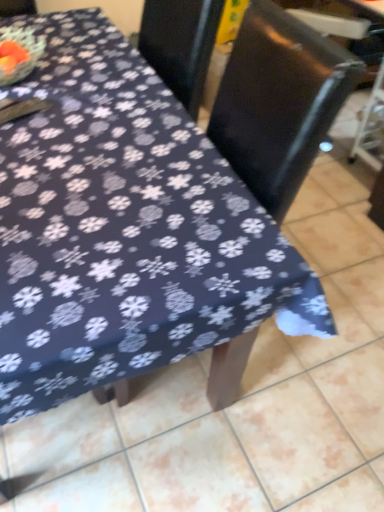
Question: Considering the relative sizes of black plastic swivel chair at right and black glossy chair at upper center in the image provided, is black plastic swivel chair at right thinner than black glossy chair at upper center?

Choices:
 (A) yes
 (B) no

Answer: (B)

Question: Does black plastic swivel chair at right have a greater width compared to black glossy chair at upper center?

Choices:
 (A) no
 (B) yes

Answer: (B)

Question: From the image's perspective, is black plastic swivel chair at right on top of black glossy chair at upper center?

Choices:
 (A) no
 (B) yes

Answer: (B)

Question: Is black plastic swivel chair at right shorter than black glossy chair at upper center?

Choices:
 (A) no
 (B) yes

Answer: (B)

Question: Is black plastic swivel chair at right not inside black glossy chair at upper center?

Choices:
 (A) no
 (B) yes

Answer: (B)

Question: From a real-world perspective, does black plastic swivel chair at right sit lower than black glossy chair at upper center?

Choices:
 (A) no
 (B) yes

Answer: (B)

Question: Can we say black glossy chair at upper center lies outside black plastic swivel chair at right?

Choices:
 (A) no
 (B) yes

Answer: (B)

Question: Is black glossy chair at upper center facing towards black plastic swivel chair at right?

Choices:
 (A) no
 (B) yes

Answer: (A)

Question: Is black glossy chair at upper center further to camera compared to black plastic swivel chair at right?

Choices:
 (A) yes
 (B) no

Answer: (B)

Question: Considering the relative sizes of black glossy chair at upper center and black plastic swivel chair at right in the image provided, is black glossy chair at upper center bigger than black plastic swivel chair at right?

Choices:
 (A) no
 (B) yes

Answer: (A)

Question: Does black glossy chair at upper center have a greater height compared to black plastic swivel chair at right?

Choices:
 (A) no
 (B) yes

Answer: (B)

Question: From the image's perspective, is black glossy chair at upper center on top of black plastic swivel chair at right?

Choices:
 (A) no
 (B) yes

Answer: (A)

Question: Does point (309, 122) appear closer or farther from the camera than point (223, 152)?

Choices:
 (A) farther
 (B) closer

Answer: (B)